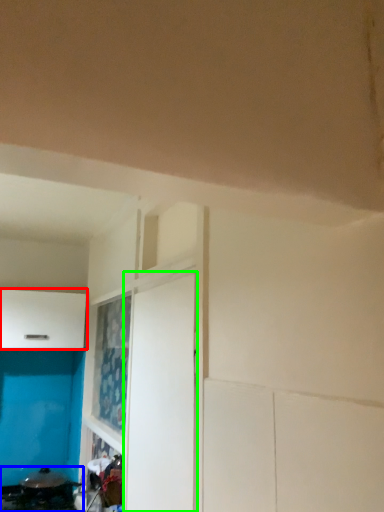
Question: Which object is the closest to the cabinetry (highlighted by a red box)? Choose among these: appliance (highlighted by a blue box) or door (highlighted by a green box).

Choices:
 (A) appliance
 (B) door

Answer: (A)